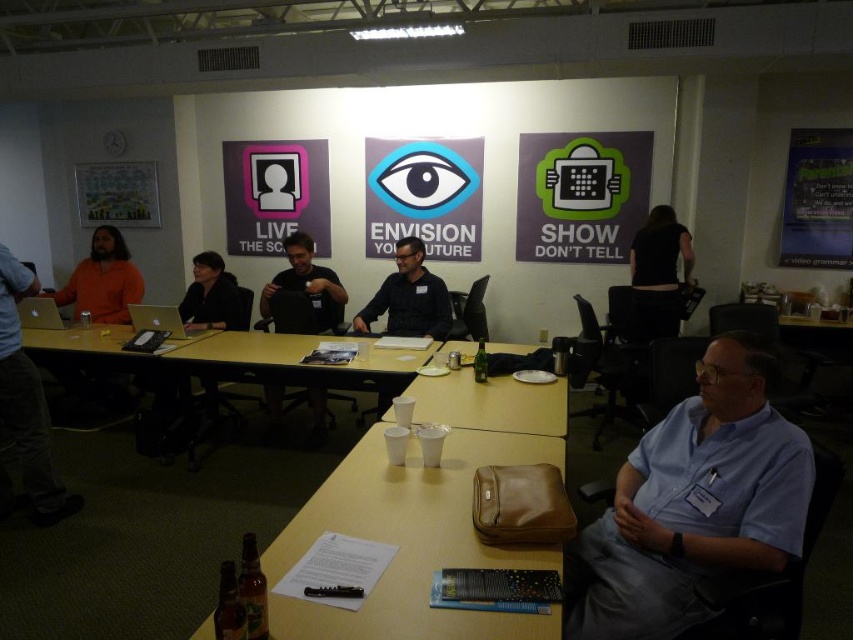
You are a guest entering the conference room and see the yellow matte table at center and the yellow wood table at center. Which table is closer to the floor?

The yellow matte table at center is closer to the floor because it is positioned below the yellow wood table at center.

You are organizing a small event in this conference room and need to place a 7.5 feet long banner between the white plastic cups at center and the silver metallic laptop at upper left. Will there be enough space to place the banner horizontally between them?

The distance between the white plastic cups at center and the silver metallic laptop at upper left is 8.51 feet. Since the banner is 7.5 feet long, which is shorter than the available space, there will be enough room to place the banner horizontally between them.

You are a caterer setting up for an event and need to place a 3.5 feet wide cake stand between the yellow matte table at center and the yellow wood table at center. Will the cake stand fit in the space between them?

The distance between the yellow matte table at center and the yellow wood table at center is 4.09 feet. Since the cake stand is 3.5 feet wide, it will fit as there is enough space between them.